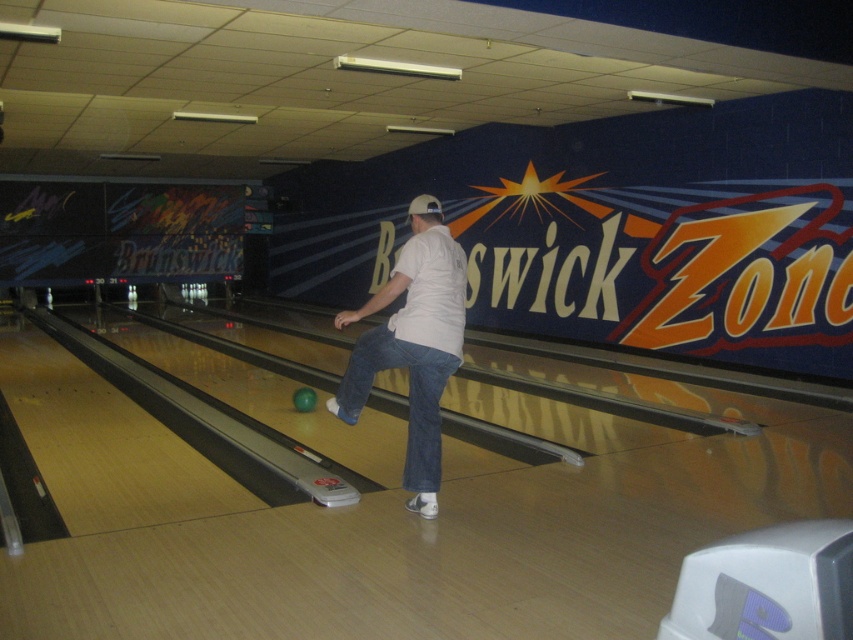
Question: From the image, what is the correct spatial relationship of white cotton shirt at center in relation to green matte bowling ball at center?

Choices:
 (A) below
 (B) above

Answer: (B)

Question: Where is white cotton shirt at center located in relation to green matte bowling ball at center in the image?

Choices:
 (A) above
 (B) below

Answer: (A)

Question: Which of the following is the closest to the observer?

Choices:
 (A) (296, 392)
 (B) (436, 364)

Answer: (B)

Question: Which is farther from the white cotton shirt at center?

Choices:
 (A) jeans at center
 (B) green matte bowling ball at center

Answer: (B)

Question: Which of these objects is positioned closest to the white cotton shirt at center?

Choices:
 (A) jeans at center
 (B) green matte bowling ball at center

Answer: (A)

Question: Observing the image, what is the correct spatial positioning of jeans at center in reference to green matte bowling ball at center?

Choices:
 (A) above
 (B) below

Answer: (A)